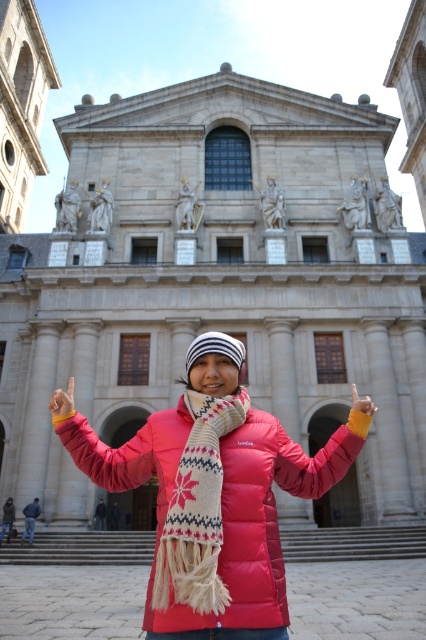
You are a photographer trying to capture a photo of the matte pink jacket at center and the stone steps at center. Which object is closer to you so that it appears larger in the photo?

The stone steps at center is further to the viewer than matte pink jacket at center, so the matte pink jacket at center will appear larger in the photo because it is closer to you.

You are a tour guide explaining the historical building to a group. You notice the matte pink jacket at center and the stone steps at center. Which object is positioned lower in the image?

The stone steps at center is located below matte pink jacket at center, so the stone steps at center is positioned lower in the image.